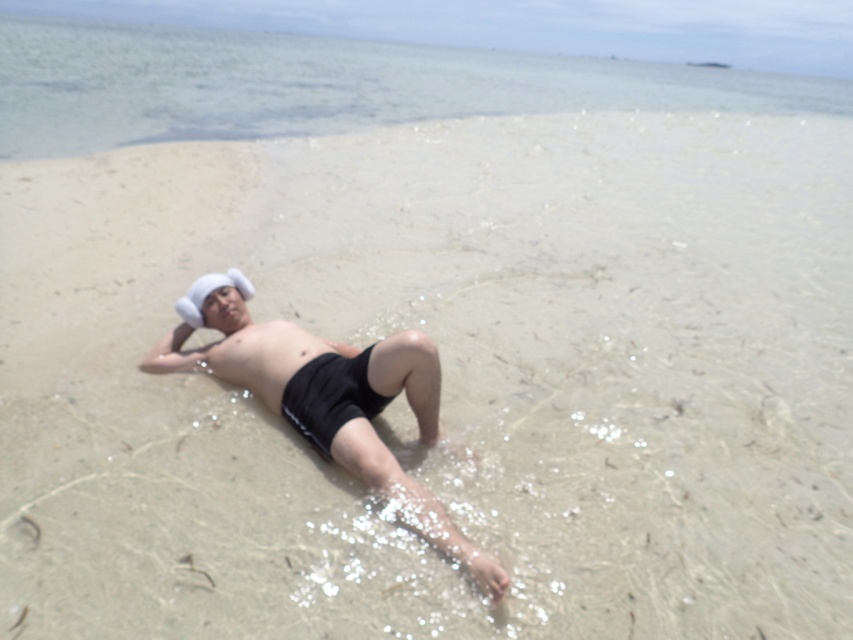
Question: Does clear water at upper center appear on the left side of matte black shorts at center?

Choices:
 (A) no
 (B) yes

Answer: (A)

Question: Among these objects, which one is nearest to the camera?

Choices:
 (A) white fabric baseball hat at upper center
 (B) clear water at upper center
 (C) matte black shorts at center

Answer: (C)

Question: Can you confirm if clear water at upper center is positioned to the right of white fabric baseball hat at upper center?

Choices:
 (A) no
 (B) yes

Answer: (B)

Question: Among these points, which one is farthest from the camera?

Choices:
 (A) (345, 410)
 (B) (462, 81)
 (C) (305, 339)

Answer: (B)

Question: Among these objects, which one is nearest to the camera?

Choices:
 (A) clear water at upper center
 (B) matte black shorts at center

Answer: (B)

Question: Does clear water at upper center have a greater width compared to smooth skin stomach at center?

Choices:
 (A) no
 (B) yes

Answer: (B)